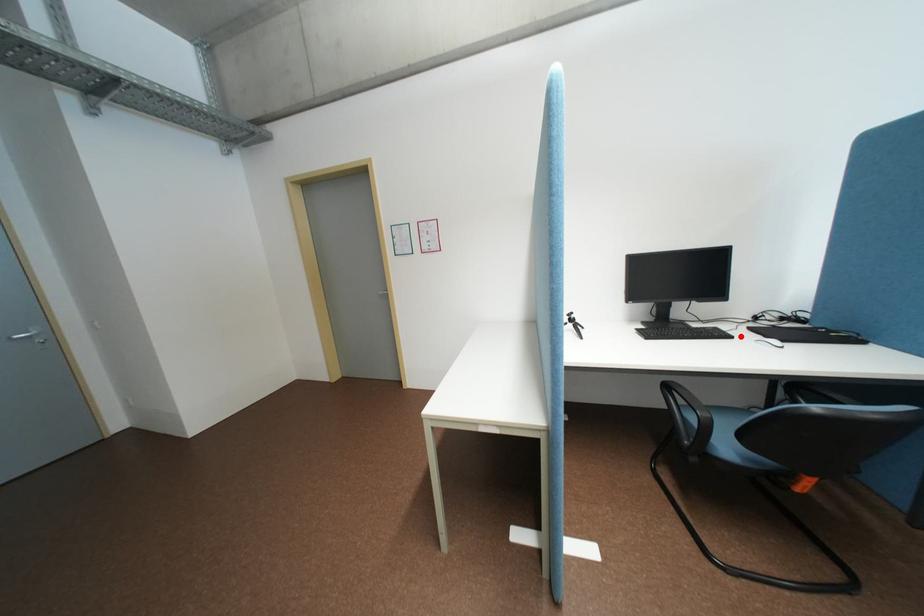
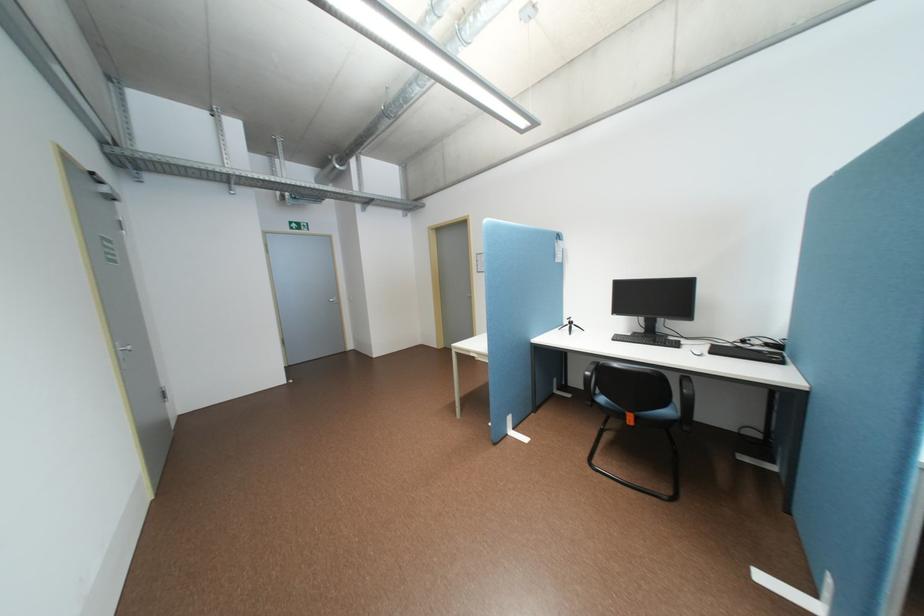
In the second image, find the point that corresponds to the highlighted location in the first image.

(688, 346)